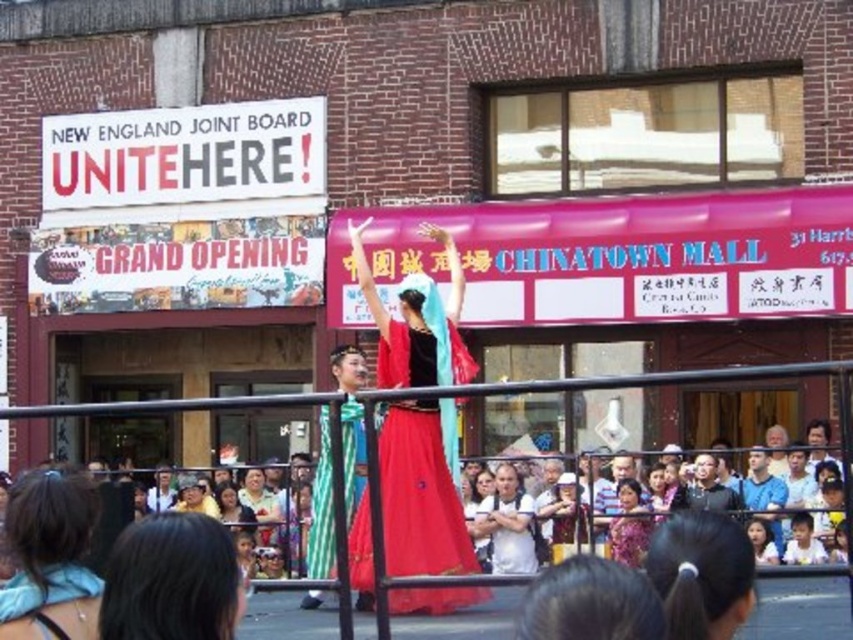
Who is positioned more to the left, black hair at center or light blue fabric at lower right?

From the viewer's perspective, black hair at center appears more on the left side.

Looking at this image, does black hair at center have a greater width compared to light blue fabric at lower right?

Correct, the width of black hair at center exceeds that of light blue fabric at lower right.

Which is in front, point (712, 550) or point (749, 508)?

Positioned in front is point (712, 550).

I want to click on black hair at center, so click(701, 573).

Image resolution: width=853 pixels, height=640 pixels. Describe the element at coordinates (50, 557) in the screenshot. I see `matte black hair at center` at that location.

Which is behind, point (56, 515) or point (769, 531)?

Point (769, 531)

Where is `matte black hair at center`? matte black hair at center is located at coordinates (50, 557).

Who is positioned more to the right, matte black hair at center or multicolored fabric crowd at center?

Positioned to the right is multicolored fabric crowd at center.

Is point (54, 602) more distant than point (802, 593)?

No, (54, 602) is closer to viewer.

Which is behind, point (41, 632) or point (488, 627)?

Positioned behind is point (488, 627).

You are a GUI agent. You are given a task and a screenshot of the screen. Output one action in this format:
    pyautogui.click(x=<x>, y=<y>)
    Task: Click on the matte black hair at center
    
    Given the screenshot: What is the action you would take?
    pyautogui.click(x=50, y=557)